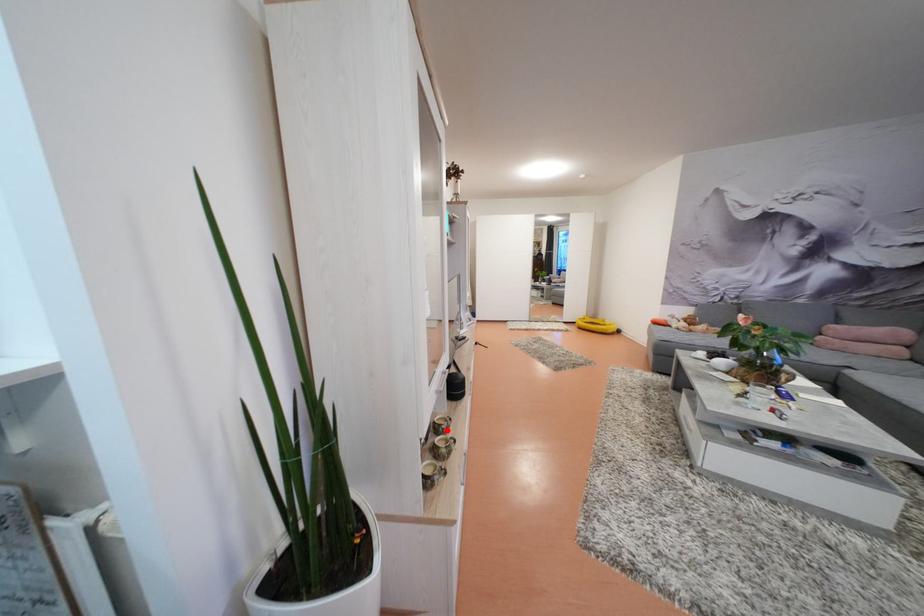
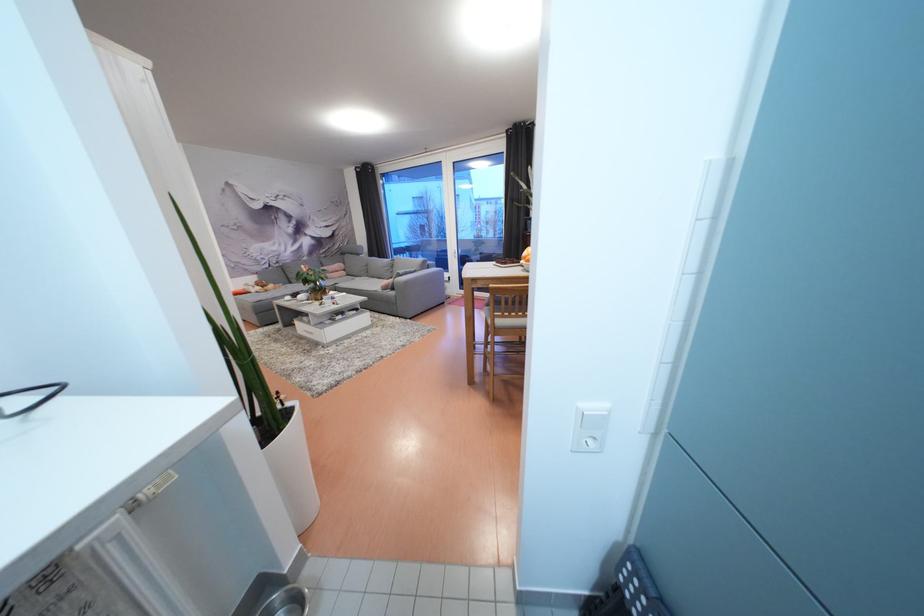
Question: I am providing you with two images of the same scene from different viewpoints. A red point is marked on the first image. Can you still see the location of the red point in image 2?

Choices:
 (A) Yes
 (B) No

Answer: (B)